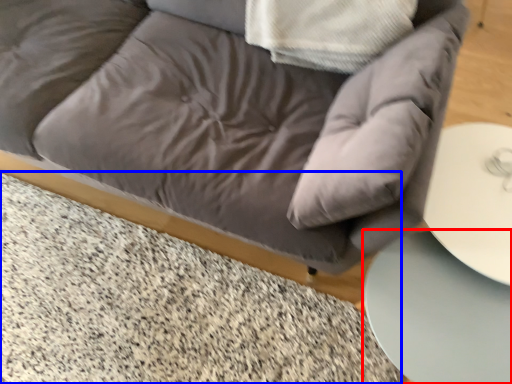
Question: Which object is further to the camera taking this photo, table (highlighted by a red box) or marble (highlighted by a blue box)?

Choices:
 (A) table
 (B) marble

Answer: (B)